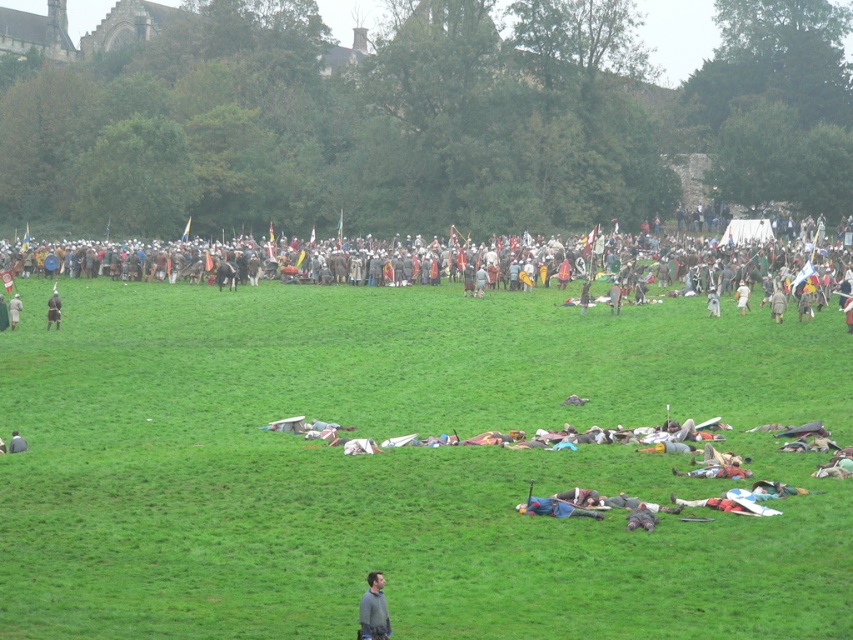
You are a photographer positioned at the camera location. You want to capture a closeup shot of the metallic armor at center. Given that your camera has a maximum zoom range of 70 meters, will you be able to take the photo?

The metallic armor at center and camera are 80.46 meters apart from each other. Since the maximum zoom is 70 meters, the photographer cannot capture a closeup shot as the distance exceeds the camera capability.

You are a photographer at the historical reenactment. You want to capture a photo that includes both the gray fabric shirt at lower center and the matte black helmet at left. Based on their positions, which object should be placed closer to the bottom of the photo?

The gray fabric shirt at lower center should be placed closer to the bottom of the photo because it is positioned under the matte black helmet at left.

You are a photographer positioned at the front of the reenactment field. You want to capture a photo that includes both the gray fabric shirt at lower center and the dark gray fabric helmet at center. Which object will appear larger in your photo?

The gray fabric shirt at lower center will appear larger in the photo because it is closer to the viewer than the dark gray fabric helmet at center.